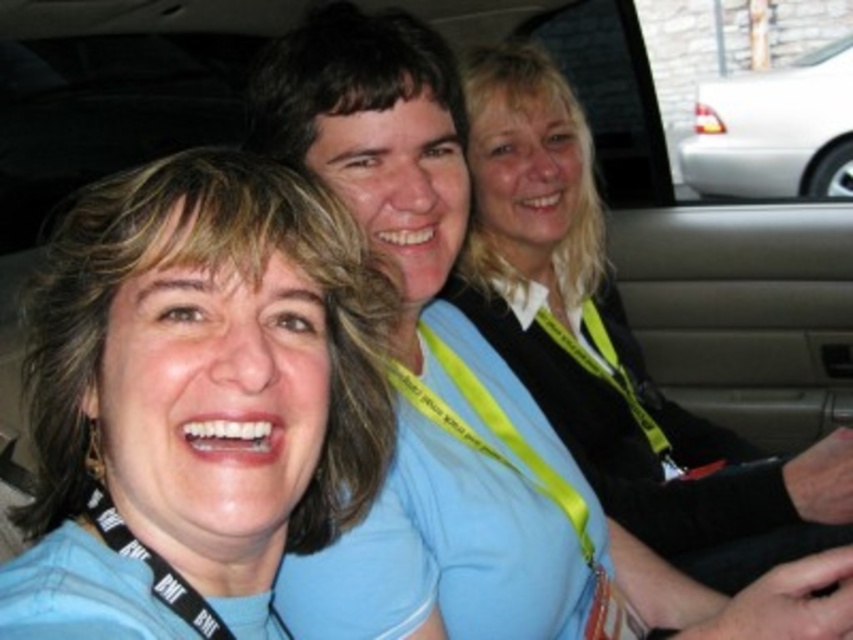
Question: Which is farther from the blue fabric face at center?

Choices:
 (A) black sweater at center
 (B) white glossy car at upper right

Answer: (B)

Question: Which of these objects is positioned closest to the blue fabric face at center?

Choices:
 (A) black sweater at center
 (B) white glossy car at upper right

Answer: (A)

Question: Where is blue fabric face at center located in relation to white glossy car at upper right in the image?

Choices:
 (A) left
 (B) right

Answer: (A)

Question: Is blue fabric face at center above white glossy car at upper right?

Choices:
 (A) no
 (B) yes

Answer: (A)

Question: Can you confirm if blue fabric face at center is smaller than black sweater at center?

Choices:
 (A) yes
 (B) no

Answer: (A)

Question: Which of these objects is positioned farthest from the blue fabric face at center?

Choices:
 (A) black sweater at center
 (B) white glossy car at upper right

Answer: (B)